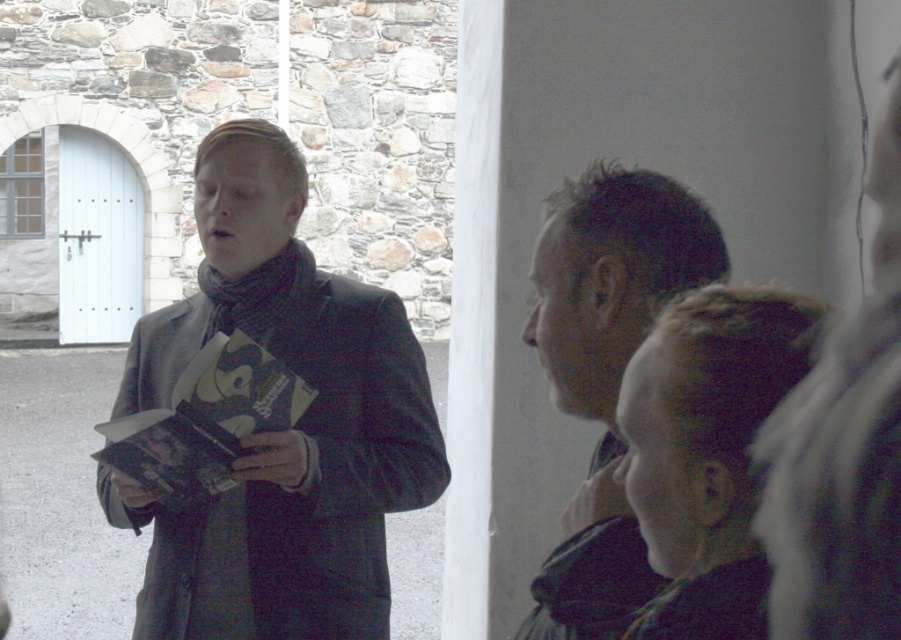
Question: Can you confirm if matte black jacket at left is positioned to the left of dark brown hair at center?

Choices:
 (A) no
 (B) yes

Answer: (B)

Question: Is dark brown hair at center positioned behind velvet-like brown robe at lower right?

Choices:
 (A) yes
 (B) no

Answer: (A)

Question: Estimate the real-world distances between objects in this image. Which object is farther from the dark brown hair at center?

Choices:
 (A) velvet-like brown robe at lower right
 (B) matte black jacket at left

Answer: (B)

Question: Based on their relative distances, which object is nearer to the dark brown hair at center?

Choices:
 (A) matte black jacket at left
 (B) velvet-like brown robe at lower right

Answer: (B)

Question: Is matte black jacket at left further to camera compared to dark brown hair at center?

Choices:
 (A) yes
 (B) no

Answer: (A)

Question: Which point is farther to the camera?

Choices:
 (A) (620, 323)
 (B) (620, 573)

Answer: (A)